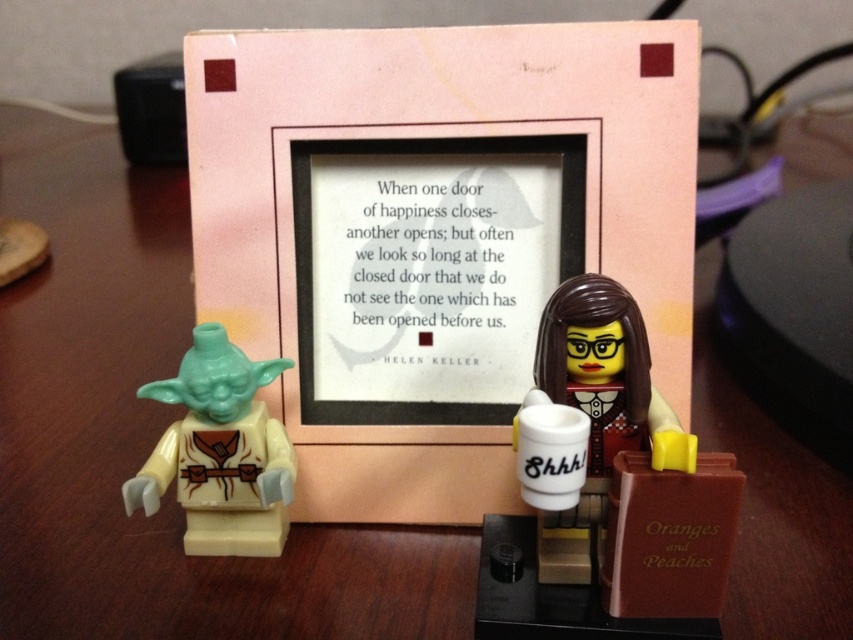
You are a photographer standing 36 inches away from the wooden desk setup. You want to take a closeup photo of the light green plastic yoda at left without moving the camera. Is the yoda within your camera range?

The light green plastic yoda at left is 33.44 inches away from viewer. Since the photographer is standing 36 inches away, the yoda is within the camera range as it is closer than the photographer.

You are standing in front of the desk with the framed quote. There are two points marked on the desk surface. One is at coordinates point (x=189, y=429) and the other at point (x=602, y=328). Which point is closer to you?

Point (x=189, y=429) is closer to you because it is further to the viewer than point (x=602, y=328).

You are setting up a display on a desk. You have a light green plastic yoda at left and a white glossy mug at center. If you need to place both items side by side on the desk, which item requires more horizontal space?

The light green plastic yoda at left might be wider than the white glossy mug at center, so it requires more horizontal space.